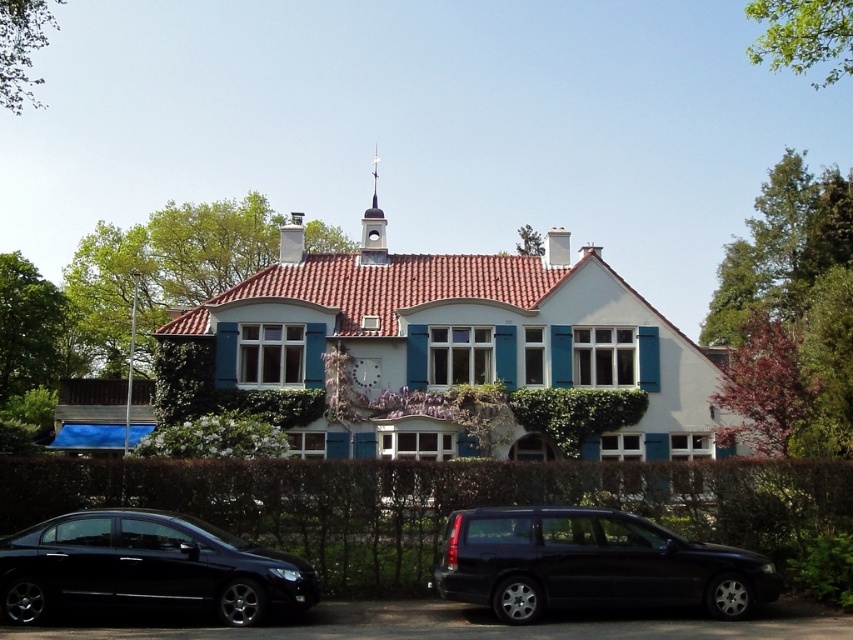
Question: Which object is positioned closest to the green hedge at lower center?

Choices:
 (A) black metallic car at lower center
 (B) black glossy sedan at lower left

Answer: (A)

Question: Which point appears farthest from the camera in this image?

Choices:
 (A) (212, 468)
 (B) (20, 573)
 (C) (532, 541)

Answer: (A)

Question: Observing the image, what is the correct spatial positioning of green hedge at lower center in reference to black glossy sedan at lower left?

Choices:
 (A) above
 (B) below

Answer: (A)

Question: Considering the real-world distances, which object is closest to the green hedge at lower center?

Choices:
 (A) black metallic car at lower center
 (B) black glossy sedan at lower left

Answer: (A)

Question: From the image, what is the correct spatial relationship of black metallic car at lower center in relation to black glossy sedan at lower left?

Choices:
 (A) right
 (B) left

Answer: (A)

Question: Can you confirm if green hedge at lower center is wider than black glossy sedan at lower left?

Choices:
 (A) no
 (B) yes

Answer: (B)